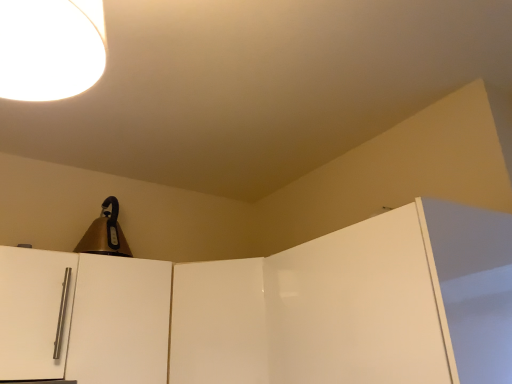
Question: Is satin white door handle at left, placed as the first door when sorted from left to right, located outside glossy white door at upper right, the fourth door from the left?

Choices:
 (A) yes
 (B) no

Answer: (A)

Question: From the image's perspective, does satin white door handle at left, placed as the fourth door when sorted from right to left, appear lower than glossy white door at upper right, the fourth door from the left?

Choices:
 (A) yes
 (B) no

Answer: (A)

Question: Could you tell me if satin white door handle at left, placed as the fourth door when sorted from right to left, is facing glossy white door at upper right, the first door in the right-to-left sequence?

Choices:
 (A) yes
 (B) no

Answer: (B)

Question: Can you confirm if satin white door handle at left, placed as the fourth door when sorted from right to left, is positioned to the left of glossy white door at upper right, the fourth door from the left?

Choices:
 (A) yes
 (B) no

Answer: (A)

Question: Is satin white door handle at left, placed as the fourth door when sorted from right to left, at the right side of glossy white door at upper right, the first door in the right-to-left sequence?

Choices:
 (A) no
 (B) yes

Answer: (A)

Question: Considering the relative sizes of satin white door handle at left, placed as the fourth door when sorted from right to left, and glossy white door at upper right, the fourth door from the left, in the image provided, is satin white door handle at left, placed as the fourth door when sorted from right to left, bigger than glossy white door at upper right, the fourth door from the left,?

Choices:
 (A) yes
 (B) no

Answer: (B)

Question: Is the depth of white glossy cabinet door at left, which is the second door from left to right, less than that of satin white door handle at left, placed as the fourth door when sorted from right to left?

Choices:
 (A) no
 (B) yes

Answer: (A)

Question: Can you confirm if white glossy cabinet door at left, which is the second door from left to right, is thinner than satin white door handle at left, placed as the fourth door when sorted from right to left?

Choices:
 (A) yes
 (B) no

Answer: (B)

Question: Is white glossy cabinet door at left, which is the second door from left to right, facing towards satin white door handle at left, placed as the fourth door when sorted from right to left?

Choices:
 (A) yes
 (B) no

Answer: (B)

Question: Does white glossy cabinet door at left, the 3th door from the right, have a greater width compared to satin white door handle at left, placed as the first door when sorted from left to right?

Choices:
 (A) no
 (B) yes

Answer: (B)

Question: Considering the relative positions of white glossy cabinet door at left, the 3th door from the right, and satin white door handle at left, placed as the fourth door when sorted from right to left, in the image provided, is white glossy cabinet door at left, the 3th door from the right, to the left of satin white door handle at left, placed as the fourth door when sorted from right to left, from the viewer's perspective?

Choices:
 (A) yes
 (B) no

Answer: (B)

Question: Can you confirm if white glossy cabinet door at left, which is the second door from left to right, is positioned to the right of satin white door handle at left, placed as the fourth door when sorted from right to left?

Choices:
 (A) no
 (B) yes

Answer: (B)

Question: Considering the relative sizes of gold metallic bell at upper left and glossy white door at upper right, the first door in the right-to-left sequence, in the image provided, is gold metallic bell at upper left taller than glossy white door at upper right, the first door in the right-to-left sequence,?

Choices:
 (A) yes
 (B) no

Answer: (B)